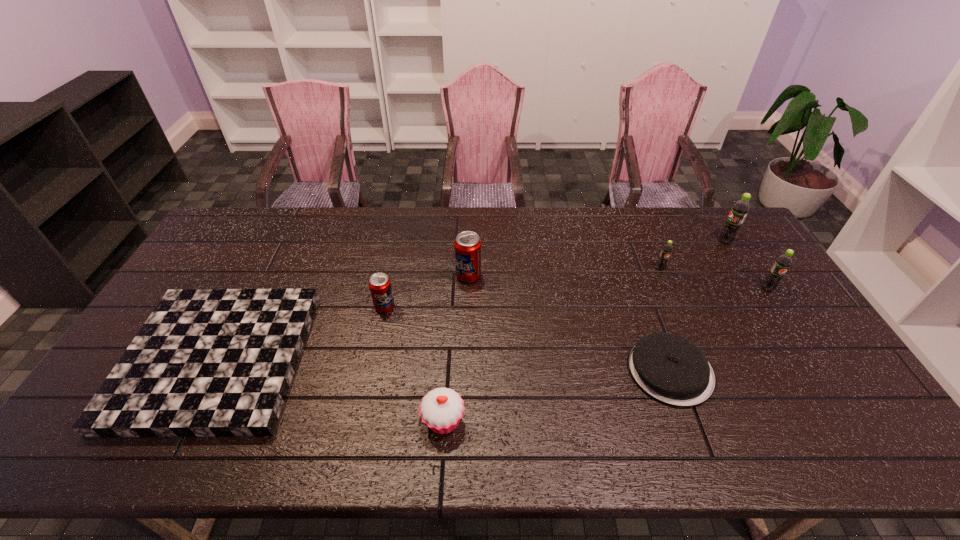
Where is `free space located on the left of the pink cupcake`? free space located on the left of the pink cupcake is located at coordinates (254, 420).

At what (x,y) coordinates should I click in order to perform the action: click on vacant space located 0.370m on the back of the pancake. Please return your answer as a coordinate pair (x, y). The width and height of the screenshot is (960, 540). Looking at the image, I should click on (627, 252).

Locate an element on the screen. This screenshot has width=960, height=540. vacant area situated 0.300m on the right of the shortest object is located at coordinates (411, 359).

At what (x,y) coordinates should I click in order to perform the action: click on object situated at the far edge. Please return your answer as a coordinate pair (x, y). Looking at the image, I should click on (740, 209).

Where is `cupcake that is at the near edge`? The width and height of the screenshot is (960, 540). cupcake that is at the near edge is located at coordinates (441, 410).

Find the location of a particular element. This screenshot has height=540, width=960. checkerboard present at the near edge is located at coordinates (207, 362).

Find the location of a particular element. The image size is (960, 540). object that is at the left edge is located at coordinates (207, 362).

At what (x,y) coordinates should I click in order to perform the action: click on object located in the near left corner section of the desktop. Please return your answer as a coordinate pair (x, y). Image resolution: width=960 pixels, height=540 pixels. Looking at the image, I should click on (207, 362).

This screenshot has height=540, width=960. I want to click on object present at the far right corner, so click(x=740, y=209).

Identify the location of vacant space at the far edge of the desktop. (434, 217).